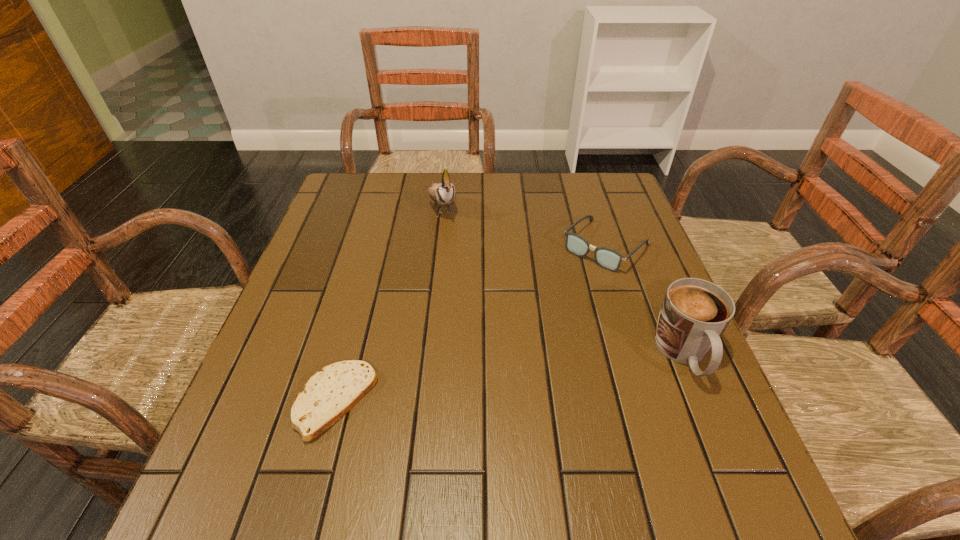
Locate an element on the screen. Image resolution: width=960 pixels, height=540 pixels. vacant space on the desktop that is between the leftmost object and the second tallest object and is positioned on the face of the second shortest object is located at coordinates (471, 383).

Identify the location of free space on the desktop that is between the shortest object and the mug and is positioned at the face of the second object from left to right. (522, 376).